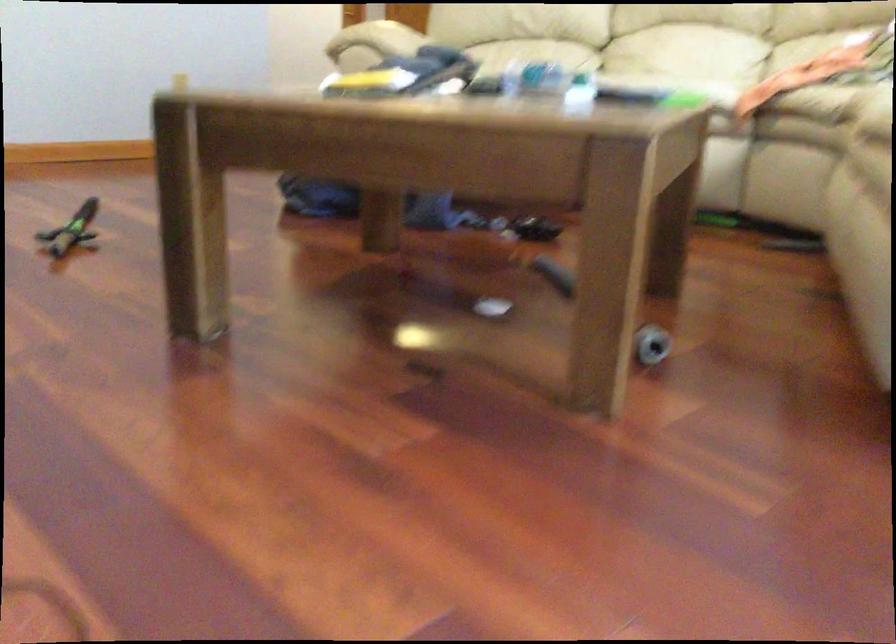
The image size is (896, 644). What do you see at coordinates (371, 44) in the screenshot? I see `a sofa armrest` at bounding box center [371, 44].